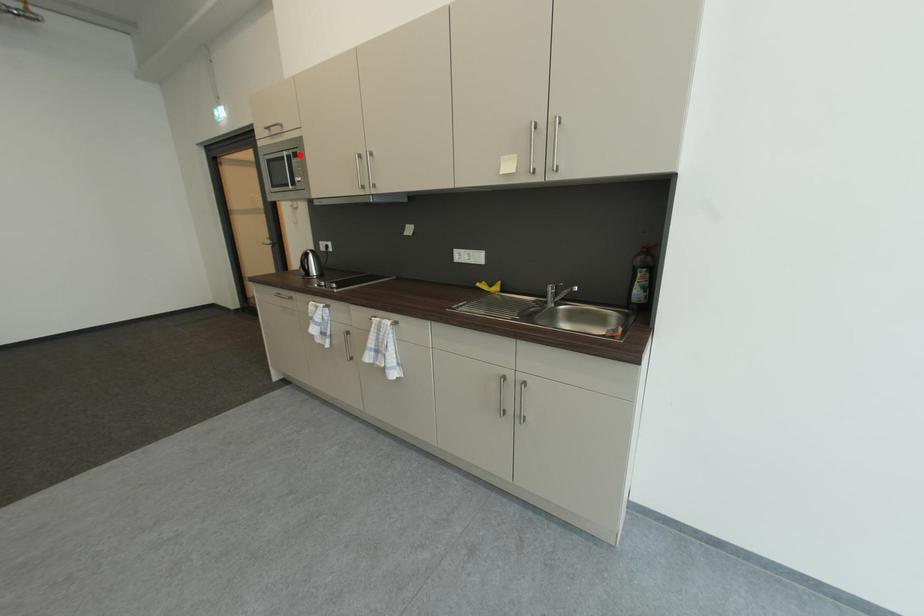
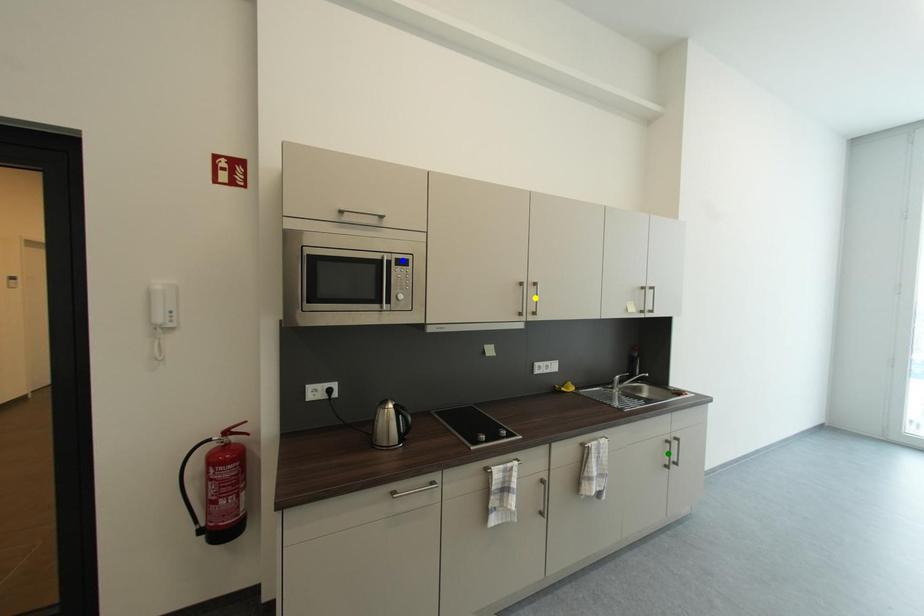
Question: I am providing you with two images of the same scene from different viewpoints. A red point is marked on the first image. You are given multiple points on the second image. In image 2, which mark is for the same physical point as the one in image 1?

Choices:
 (A) green point
 (B) yellow point
 (C) blue point

Answer: (C)